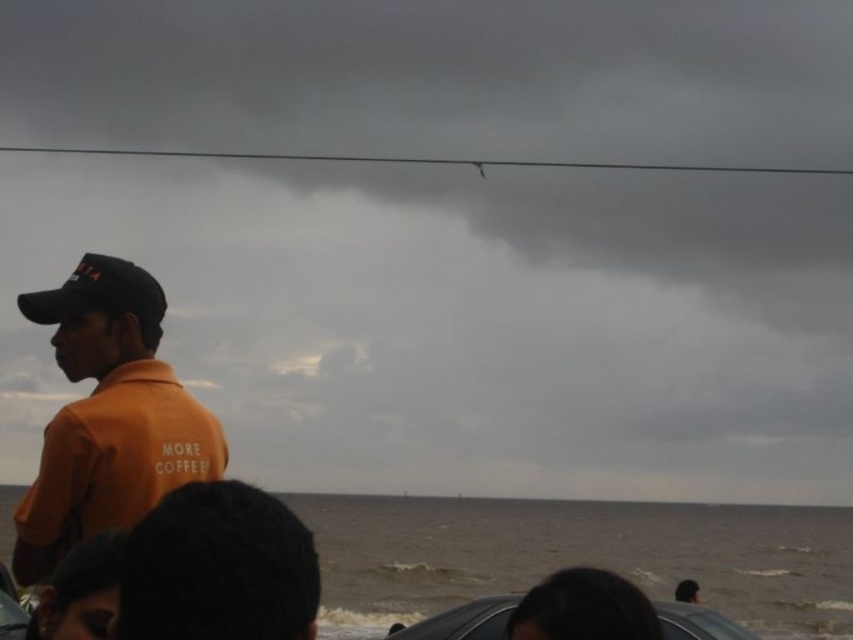
You are a photographer trying to capture the orange cotton shirt at left and the dark gray water at lower center in a single frame. Based on their widths, which object would require you to zoom out more to include its entire width in the photo?

The dark gray water at lower center has a greater width than the orange cotton shirt at left, so you would need to zoom out more to include its entire width in the photo.

You are standing at the center of the image and want to locate the orange matte shirt at left. In which direction should you look to find it?

The orange matte shirt at left is located at point 0.650 on the x axis and 0.128 on the y axis. Since the x coordinate is 0.650, which is greater than 0.5, it means the orange matte shirt at left is to the right side of the image. Therefore, you should look to your right to find it.